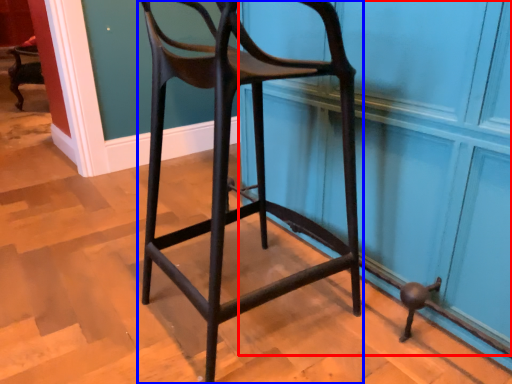
Question: Which of the following is the farthest to the observer, screen door (highlighted by a red box) or chair (highlighted by a blue box)?

Choices:
 (A) screen door
 (B) chair

Answer: (A)